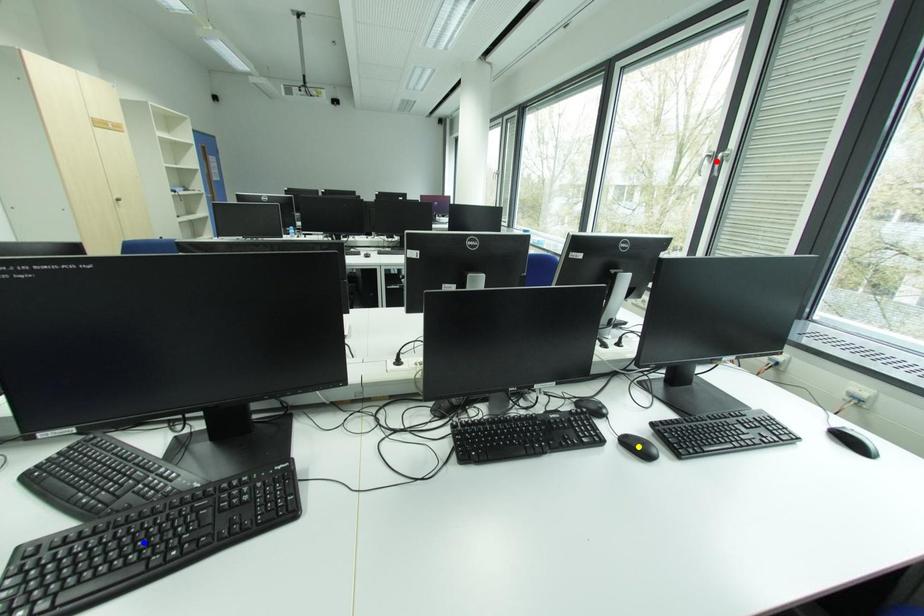
Order these from nearest to farthest:
A) blue point
B) red point
C) yellow point

1. red point
2. yellow point
3. blue point